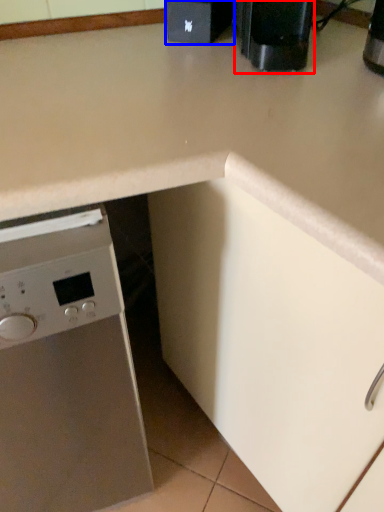
Question: Which object is closer to the camera taking this photo, coffee machine (highlighted by a red box) or appliance (highlighted by a blue box)?

Choices:
 (A) coffee machine
 (B) appliance

Answer: (A)